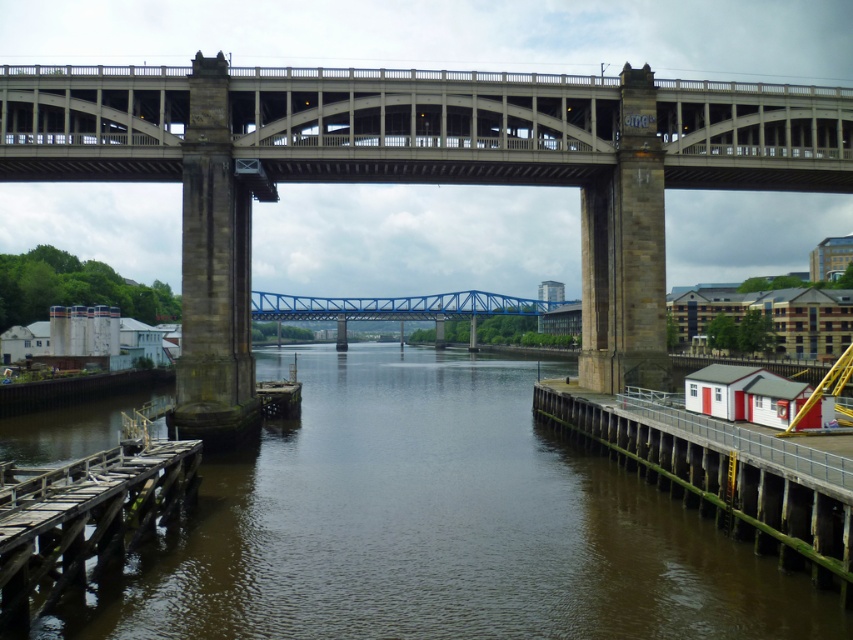
Question: Among these objects, which one is farthest from the camera?

Choices:
 (A) wooden planks dock at lower left
 (B) brown muddy water at center
 (C) white wooden dock at right
 (D) concrete bridge at center

Answer: (D)

Question: Is brown muddy water at center smaller than wooden planks dock at lower left?

Choices:
 (A) no
 (B) yes

Answer: (A)

Question: Which point appears closest to the camera in this image?

Choices:
 (A) (38, 616)
 (B) (705, 628)
 (C) (769, 445)
 (D) (688, 176)

Answer: (B)

Question: Does brown muddy water at center appear on the right side of wooden planks dock at lower left?

Choices:
 (A) no
 (B) yes

Answer: (A)

Question: Observing the image, what is the correct spatial positioning of brown muddy water at center in reference to white wooden dock at right?

Choices:
 (A) below
 (B) above

Answer: (A)

Question: Which point is closer to the camera taking this photo?

Choices:
 (A) (682, 179)
 (B) (120, 545)

Answer: (B)